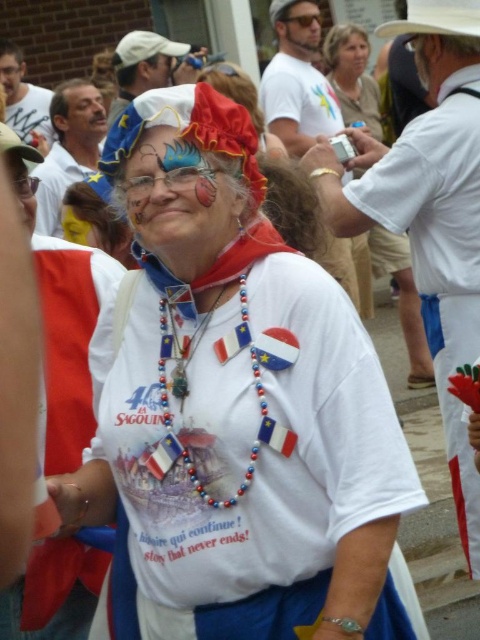
Based on the scene described, if you were standing at point (477,6) and wanted to move towards point (217,586), would you be moving forward or backward relative to your current position?

Moving towards point (217,586) from point (477,6) would mean moving forward since point (217,586) is in front of point (477,6).

What is the position of the multicolored beaded necklace at center in the image?

The multicolored beaded necklace at center is located at point (260, 413).